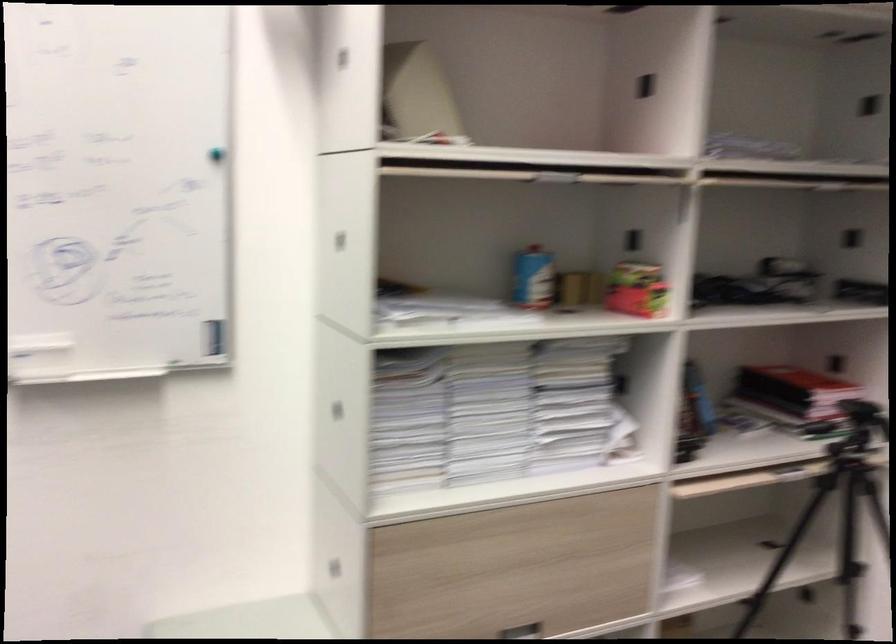
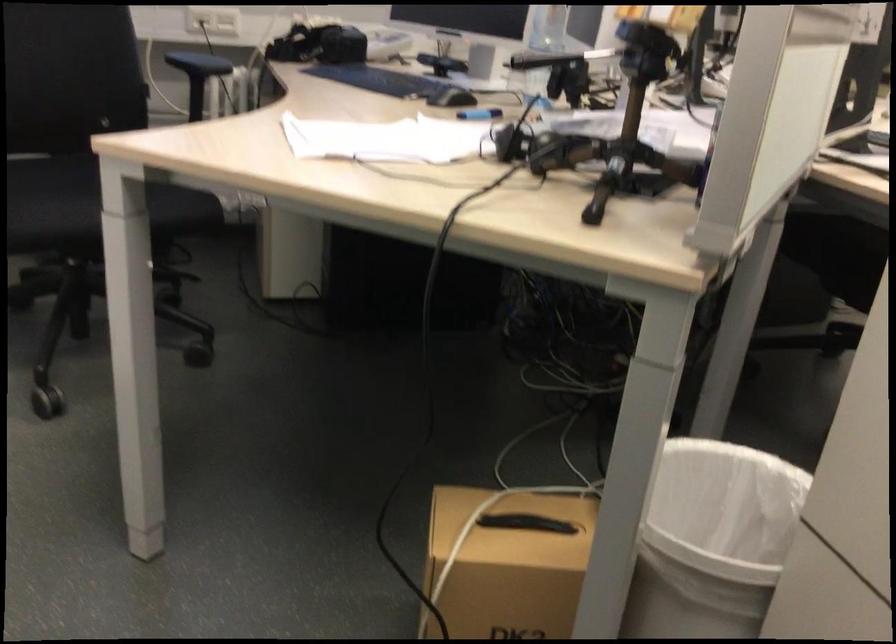
Based on the continuous images, in which direction is the camera rotating?

The camera rotated toward left-down.